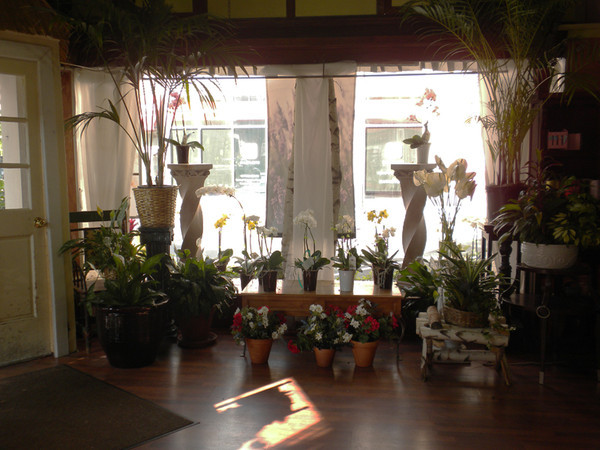
You are a GUI agent. You are given a task and a screenshot of the screen. Output one action in this format:
    pyautogui.click(x=<x>, y=<y>)
    Task: Click on the curtains
    
    Given the screenshot: What is the action you would take?
    pyautogui.click(x=111, y=175), pyautogui.click(x=306, y=165)